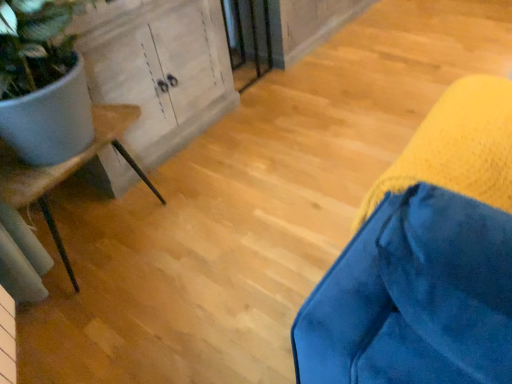
You are a GUI agent. You are given a task and a screenshot of the screen. Output one action in this format:
    pyautogui.click(x=<x>, y=<y>)
    Task: Click on the empty space that is in between wooden cabinet at left and white matte plant pot at left, arranged as the 1th furniture when viewed from the left
    This screenshot has width=512, height=384.
    Given the screenshot: What is the action you would take?
    pyautogui.click(x=189, y=172)